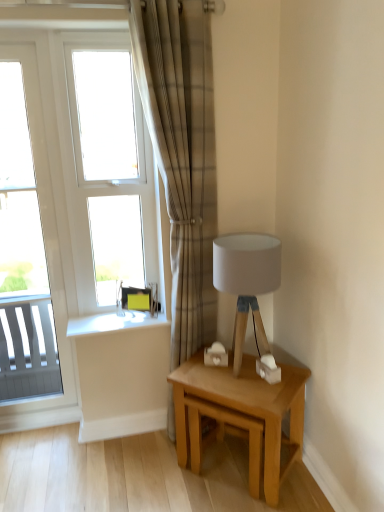
Find the location of a particular element. This screenshot has height=512, width=384. free space in front of plaid fabric curtain at center is located at coordinates (171, 472).